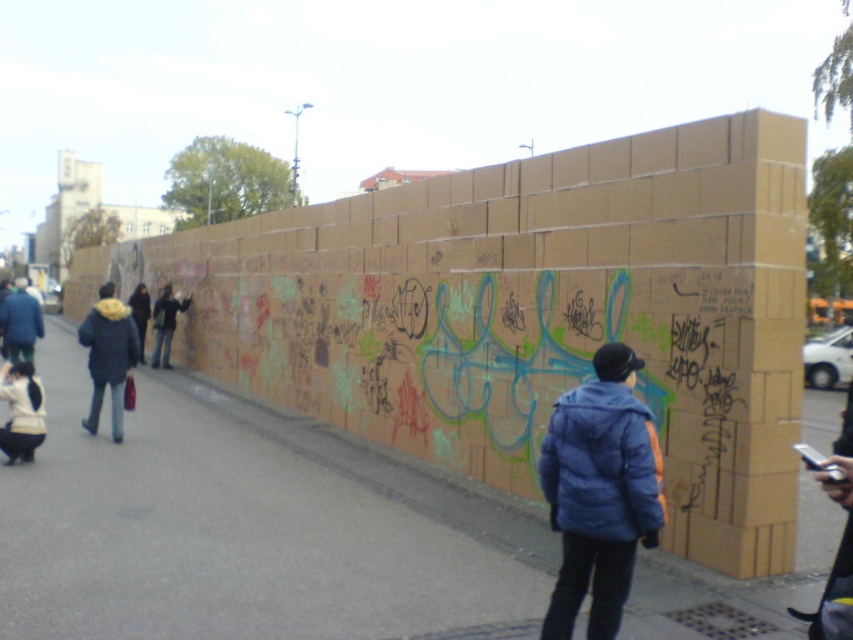
You are a photographer standing on the street in front of the graffiti wall. You want to take a photo that includes both the matte blue jacket at left and the dark blue jacket at left. Which jacket will appear smaller in the photo?

The matte blue jacket at left will appear smaller in the photo because it is not as tall as the dark blue jacket at left, meaning it is shorter in height and thus would occupy less space in the image.

You are a photographer trying to capture both the white fleece jacket at lower left and the denim jacket at left in a single frame. Which jacket should you focus on to ensure both are in the frame without zooming in too much?

The white fleece jacket at lower left is smaller than the denim jacket at left, so focusing on the denim jacket at left would allow both jackets to fit within the frame without excessive zooming.

You are standing on the paved street in front of the graffiti wall. You see two jackets in the scene. Which jacket is positioned lower down from your viewpoint? The jackets are the white fleece jacket at lower left and the denim jacket at left.

The white fleece jacket at lower left is positioned lower down than the denim jacket at left from your viewpoint.